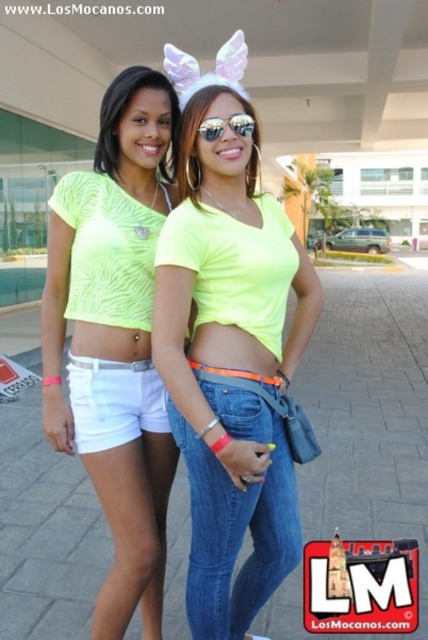
Question: Which of these objects is positioned closest to the denim jeans at center?

Choices:
 (A) white cotton shorts at lower left
 (B) matte neon yellow crop top at upper left
 (C) clear plastic goggles at center
 (D) neon yellow fabric top at center

Answer: (D)

Question: Estimate the real-world distances between objects in this image. Which object is closer to the neon yellow fabric shorts at lower left?

Choices:
 (A) neon yellow fabric top at center
 (B) white cotton shorts at lower left
 (C) matte neon yellow crop top at upper left

Answer: (B)

Question: Does denim jeans at center have a smaller size compared to matte neon yellow crop top at upper left?

Choices:
 (A) no
 (B) yes

Answer: (A)

Question: Which object appears closest to the camera in this image?

Choices:
 (A) neon yellow fabric top at center
 (B) neon yellow fabric shorts at lower left

Answer: (A)

Question: Does matte neon yellow crop top at upper left appear under clear plastic goggles at center?

Choices:
 (A) no
 (B) yes

Answer: (A)

Question: Observing the image, what is the correct spatial positioning of denim jeans at center in reference to matte neon yellow crop top at upper left?

Choices:
 (A) above
 (B) below

Answer: (B)